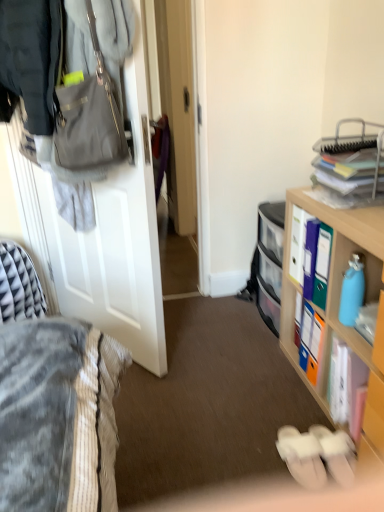
Where is `vacant area located to the right-hand side of white matte door at left`? The width and height of the screenshot is (384, 512). vacant area located to the right-hand side of white matte door at left is located at coordinates (209, 346).